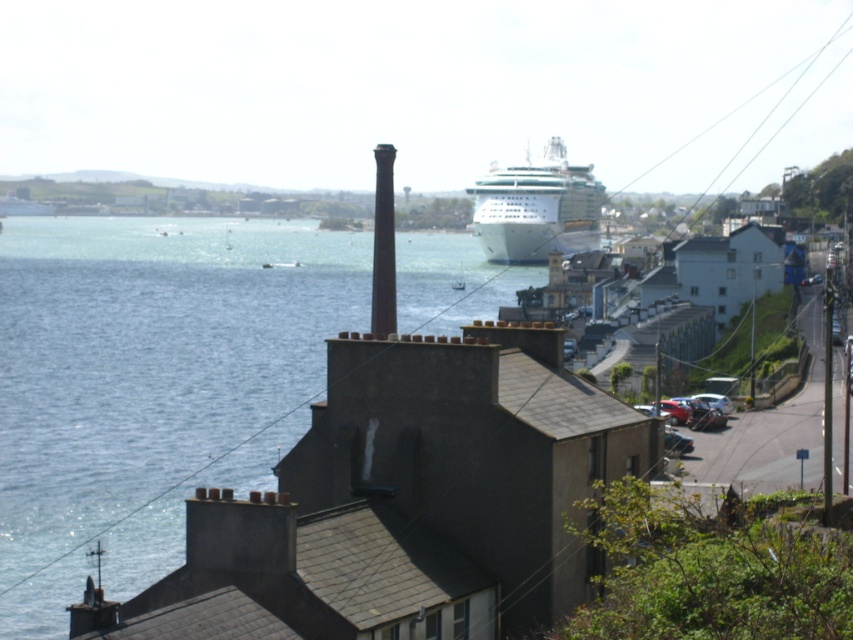
Question: Can you confirm if blue water at center is thinner than white glossy cruise ship at center?

Choices:
 (A) yes
 (B) no

Answer: (B)

Question: Which object is closer to the camera taking this photo?

Choices:
 (A) white glossy cruise ship at center
 (B) blue water at center

Answer: (B)

Question: Which object is farther from the camera taking this photo?

Choices:
 (A) blue water at center
 (B) white glossy cruise ship at center

Answer: (B)

Question: Is blue water at center bigger than white glossy cruise ship at center?

Choices:
 (A) yes
 (B) no

Answer: (A)

Question: Is blue water at center below white glossy cruise ship at center?

Choices:
 (A) no
 (B) yes

Answer: (B)

Question: Which point is farther to the camera?

Choices:
 (A) (550, 243)
 (B) (204, 380)

Answer: (A)